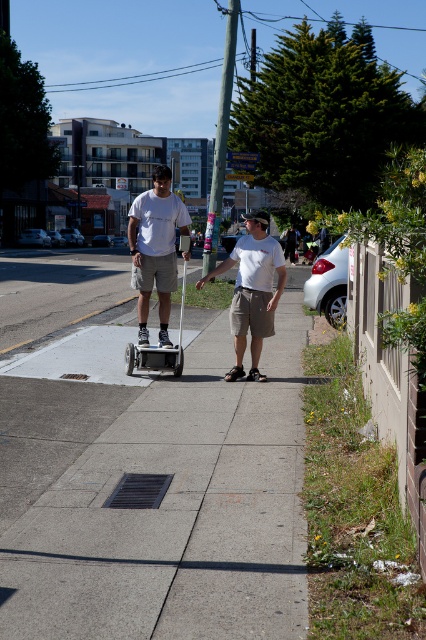
Can you confirm if matte white shirt at center is thinner than white matte t-shirt at center?

In fact, matte white shirt at center might be wider than white matte t-shirt at center.

Does point (175, 195) lie in front of point (262, 285)?

No, it is not.

Locate an element on the screen. The width and height of the screenshot is (426, 640). matte white shirt at center is located at coordinates (155, 248).

Does concrete sidewalk at center appear over matte white shirt at center?

No.

Between point (299, 358) and point (180, 214), which one is positioned behind?

The point (299, 358) is behind.

Where is `concrete sidewalk at center`? The width and height of the screenshot is (426, 640). concrete sidewalk at center is located at coordinates (176, 509).

The width and height of the screenshot is (426, 640). What do you see at coordinates (176, 509) in the screenshot? I see `concrete sidewalk at center` at bounding box center [176, 509].

Consider the image. Who is positioned more to the left, concrete sidewalk at center or white matte t-shirt at center?

From the viewer's perspective, concrete sidewalk at center appears more on the left side.

Is point (118, 579) farther from camera compared to point (261, 289)?

That is False.

The height and width of the screenshot is (640, 426). I want to click on concrete sidewalk at center, so pos(176,509).